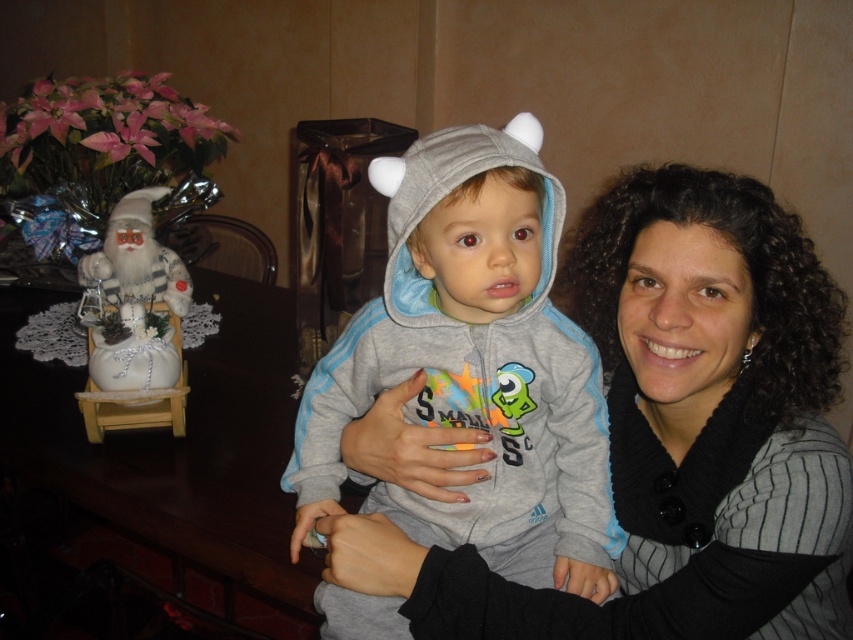
Consider the image. You are a photographer trying to capture a closeup of the gray fleece hoodie at center. Based on its position coordinates, where should you aim your camera?

The gray fleece hoodie at center is located at coordinates point (474, 362), so you should aim your camera at that position to capture the closeup.

You are a photographer setting up for a family photo. You need to ensure that the gray fleece hoodie at center and the white fabric santa at left are both visible in the frame. Based on their positions, which object is closer to the camera?

The gray fleece hoodie at center is closer to the camera because it is positioned below the white fabric santa at left, indicating it is in a lower and nearer position in the scene.

You are a photographer setting up for a family photo. You notice the gray fleece hoodie at center and the white fabric santa at left in the scene. Which object should you ensure stays in frame to avoid cropping the taller one?

The gray fleece hoodie at center is taller than the white fabric santa at left, so you should ensure the gray fleece hoodie at center stays in frame to avoid cropping the taller one.